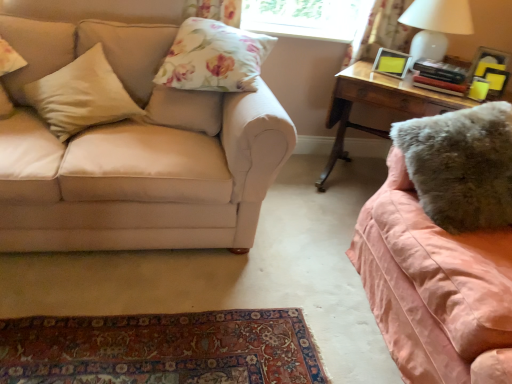
You are a GUI agent. You are given a task and a screenshot of the screen. Output one action in this format:
    pyautogui.click(x=<x>, y=<y>)
    Task: Click on the free spot to the left of wooden desk at right
    Image resolution: width=512 pixels, height=384 pixels.
    Given the screenshot: What is the action you would take?
    pyautogui.click(x=304, y=198)